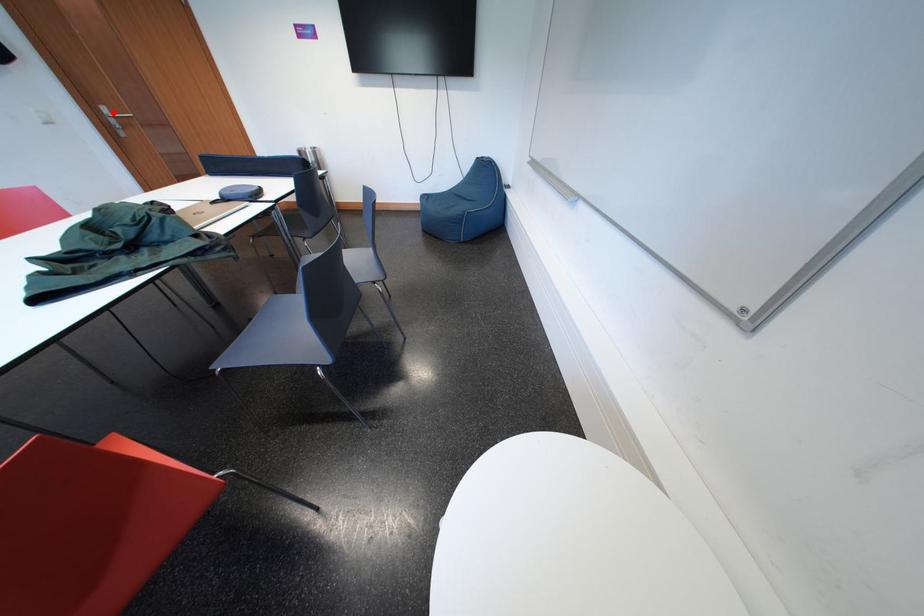
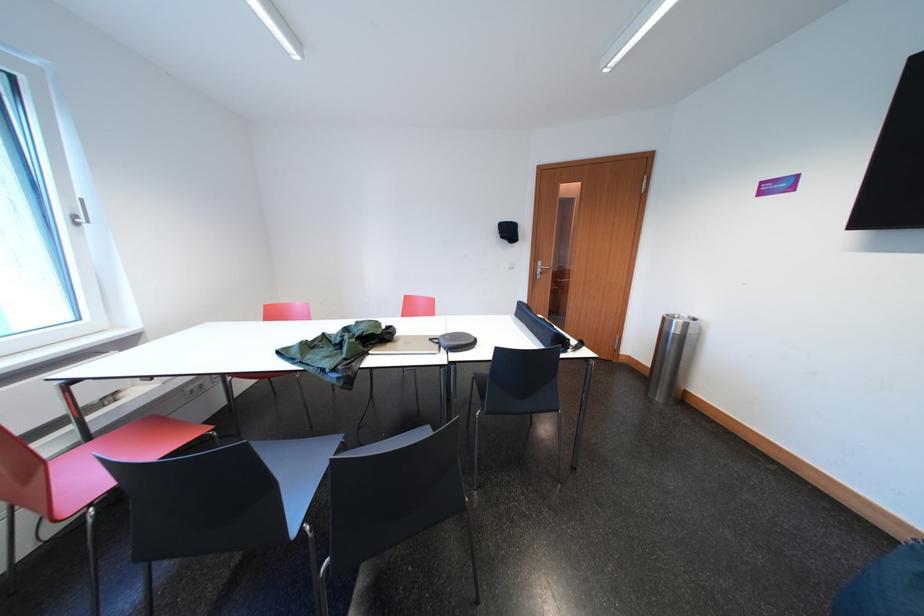
Question: A red point is marked in image1. In image2, is the corresponding 3D point closer to the camera or farther? Reply with the corresponding letter.

Choices:
 (A) The corresponding 3D point is closer.
 (B) The corresponding 3D point is farther.

Answer: (A)